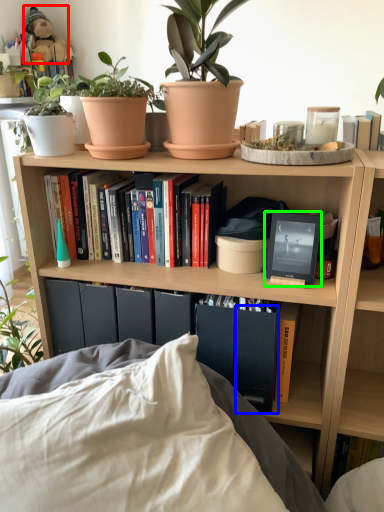
Question: Which is nearer to the toy (highlighted by a red box)? paperback book (highlighted by a blue box) or picture frame (highlighted by a green box).

Choices:
 (A) paperback book
 (B) picture frame

Answer: (B)